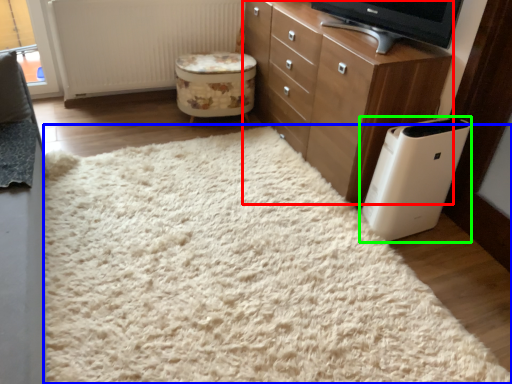
Question: Based on their relative distances, which object is farther from chest of drawers (highlighted by a red box)? Choose from plain (highlighted by a blue box) and home appliance (highlighted by a green box).

Choices:
 (A) plain
 (B) home appliance

Answer: (A)